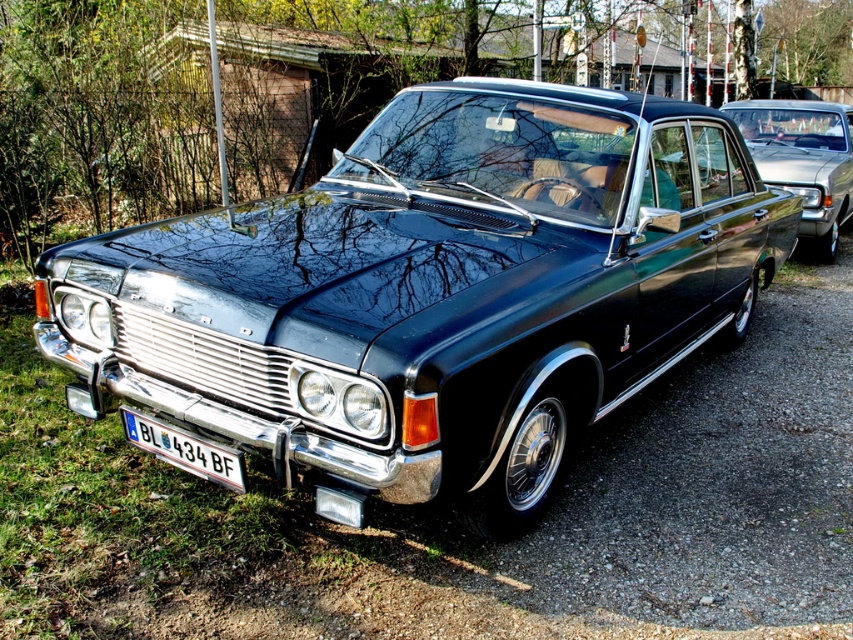
Which of these two, shiny black car at center or white plastic license plate at lower left, stands shorter?

Standing shorter between the two is white plastic license plate at lower left.

Does shiny black car at center have a lesser width compared to white plastic license plate at lower left?

No.

This screenshot has height=640, width=853. What do you see at coordinates (433, 292) in the screenshot?
I see `shiny black car at center` at bounding box center [433, 292].

The image size is (853, 640). I want to click on shiny black car at center, so click(x=433, y=292).

Does shiny metallic sedan at center have a lesser height compared to white plastic license plate at lower left?

In fact, shiny metallic sedan at center may be taller than white plastic license plate at lower left.

The image size is (853, 640). What are the coordinates of `shiny metallic sedan at center` in the screenshot? It's located at (804, 161).

Find the location of `shiny metallic sedan at center`. shiny metallic sedan at center is located at coordinates (804, 161).

Is shiny black car at center thinner than shiny metallic sedan at center?

In fact, shiny black car at center might be wider than shiny metallic sedan at center.

Based on the photo, between shiny black car at center and shiny metallic sedan at center, which one has more height?

shiny black car at center is taller.

Is point (529, 152) behind point (849, 168)?

No, it is not.

At what (x,y) coordinates should I click in order to perform the action: click on shiny black car at center. Please return your answer as a coordinate pair (x, y). Looking at the image, I should click on (433, 292).